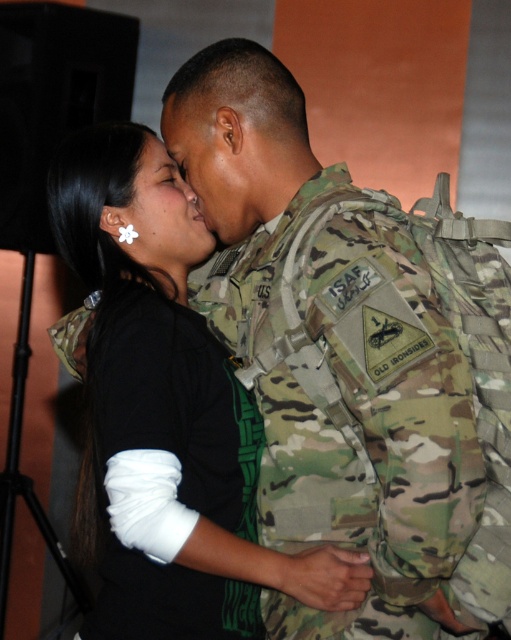
Question: Which of the following is the farthest from the observer?

Choices:
 (A) (177, 144)
 (B) (213, 596)
 (C) (286, 288)

Answer: (A)

Question: Considering the relative positions of camouflage uniform at center and black matte shirt at center in the image provided, where is camouflage uniform at center located with respect to black matte shirt at center?

Choices:
 (A) below
 (B) above

Answer: (B)

Question: Can you confirm if camouflage uniform at center is positioned below matte military uniform at center?

Choices:
 (A) yes
 (B) no

Answer: (A)

Question: Is camouflage uniform at center thinner than matte military uniform at center?

Choices:
 (A) yes
 (B) no

Answer: (B)

Question: Which of these objects is positioned farthest from the camo fabric uniform at center?

Choices:
 (A) white flower at center
 (B) matte military uniform at center
 (C) camouflage uniform at center

Answer: (B)

Question: Which point is closer to the camera?

Choices:
 (A) black matte shirt at center
 (B) white flower at center
 (C) camo fabric uniform at center
 (D) matte military uniform at center

Answer: (A)